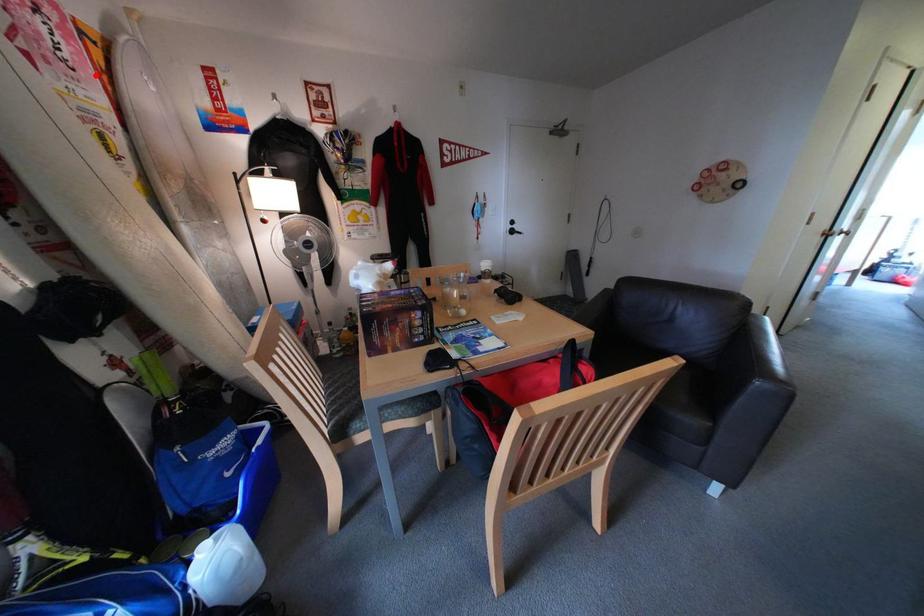
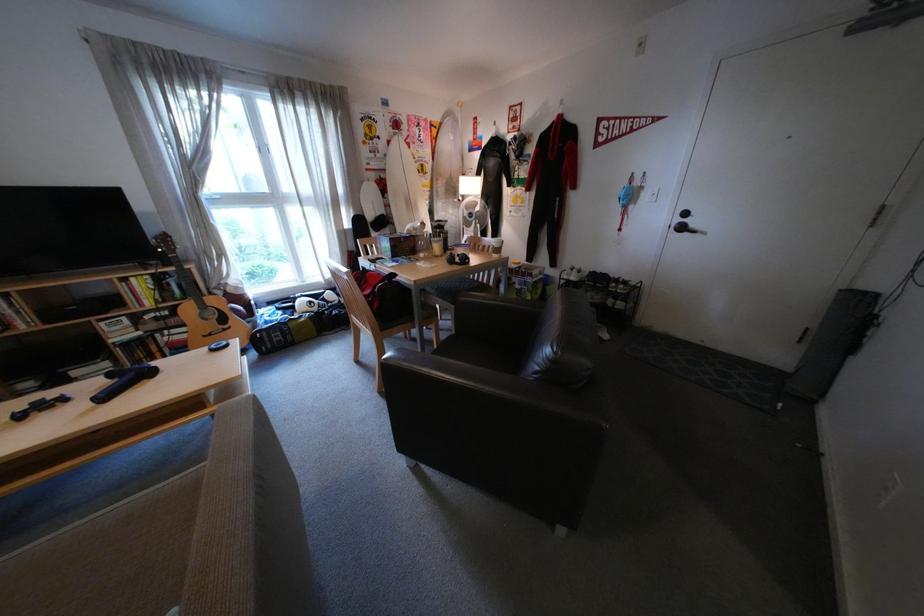
Question: A red point is marked in image1. In image2, is the corresponding 3D point closer to the camera or farther? Reply with the corresponding letter.

Choices:
 (A) The corresponding 3D point is closer.
 (B) The corresponding 3D point is farther.

Answer: (A)